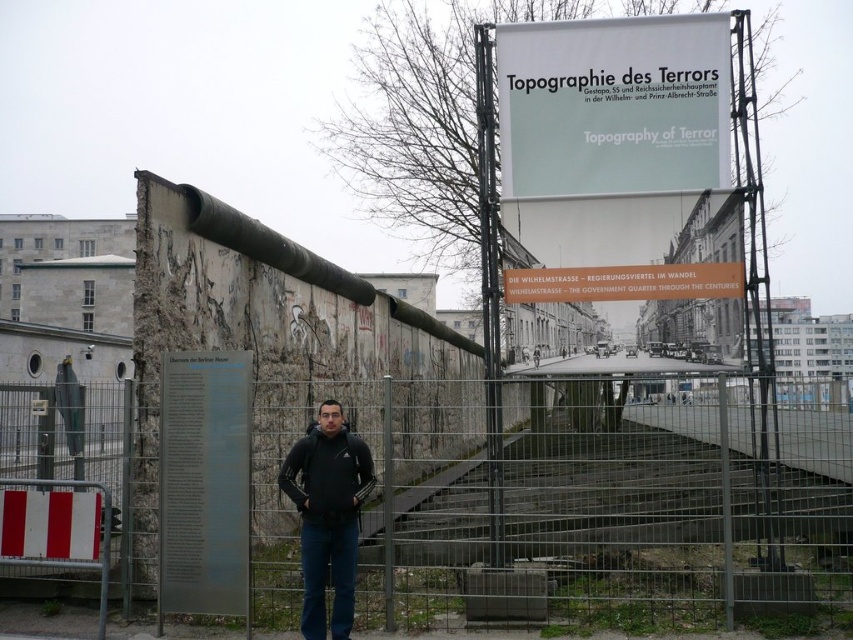
Can you confirm if metal wire fence at center is smaller than black matte jacket at center?

Incorrect, metal wire fence at center is not smaller in size than black matte jacket at center.

Is point (129, 561) more distant than point (302, 464)?

Yes, it is.

Between point (508, 522) and point (317, 588), which one is positioned in front?

Point (317, 588) is more forward.

You are a GUI agent. You are given a task and a screenshot of the screen. Output one action in this format:
    pyautogui.click(x=<x>, y=<y>)
    Task: Click on the metal wire fence at center
    The image size is (853, 640).
    Given the screenshot: What is the action you would take?
    pyautogui.click(x=578, y=497)

Does point (614, 52) come in front of point (320, 486)?

No, (614, 52) is behind (320, 486).

Does white paper sign at upper center come behind black fleece sweatshirt at center?

That is True.

Locate an element on the screen. white paper sign at upper center is located at coordinates (613, 106).

From the picture: Can you confirm if metal wire fence at center is positioned to the left of white/red striped sign at lower left?

Incorrect, metal wire fence at center is not on the left side of white/red striped sign at lower left.

Who is shorter, metal wire fence at center or white/red striped sign at lower left?

Standing shorter between the two is white/red striped sign at lower left.

Which is in front, point (714, 580) or point (0, 524)?

Point (0, 524) is in front.

Locate an element on the screen. This screenshot has height=640, width=853. metal wire fence at center is located at coordinates (578, 497).